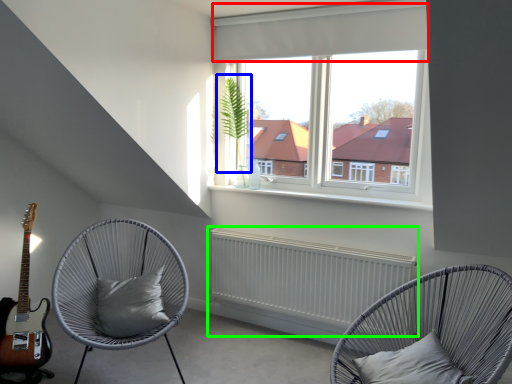
Question: Based on their relative distances, which object is farther from curtain (highlighted by a red box)? Choose from plant (highlighted by a blue box) and radiator (highlighted by a green box).

Choices:
 (A) plant
 (B) radiator

Answer: (B)